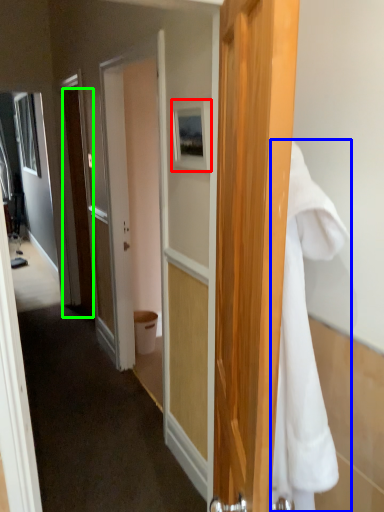
Question: Which object is positioned closest to picture frame (highlighted by a red box)? Select from towel/napkin (highlighted by a blue box) and door (highlighted by a green box).

Choices:
 (A) towel/napkin
 (B) door

Answer: (A)